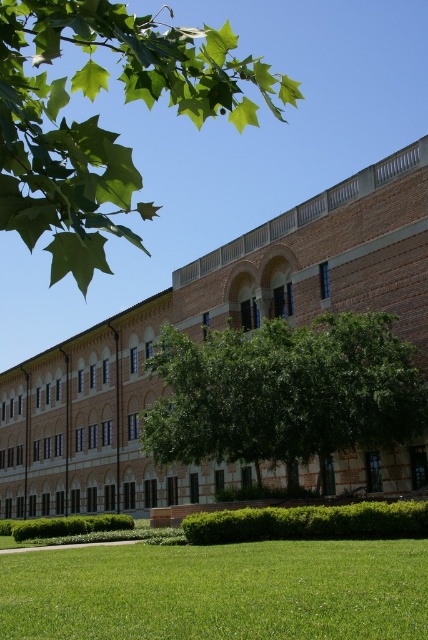
Question: Is green grass at lower center smaller than green leafy tree at center?

Choices:
 (A) yes
 (B) no

Answer: (A)

Question: Which object is closer to the camera taking this photo?

Choices:
 (A) green leafy tree at upper left
 (B) green leafy tree at center
 (C) green grass at lower center

Answer: (A)

Question: Does green grass at lower center have a larger size compared to green leafy tree at center?

Choices:
 (A) yes
 (B) no

Answer: (B)

Question: Considering the real-world distances, which object is closest to the green leafy tree at upper left?

Choices:
 (A) green leafy tree at center
 (B) green grass at lower center

Answer: (B)

Question: Which point is closer to the camera?

Choices:
 (A) [175, 60]
 (B) [290, 387]
 (C) [240, 588]

Answer: (A)

Question: Can you confirm if green leafy tree at upper left is wider than green leafy tree at center?

Choices:
 (A) no
 (B) yes

Answer: (B)